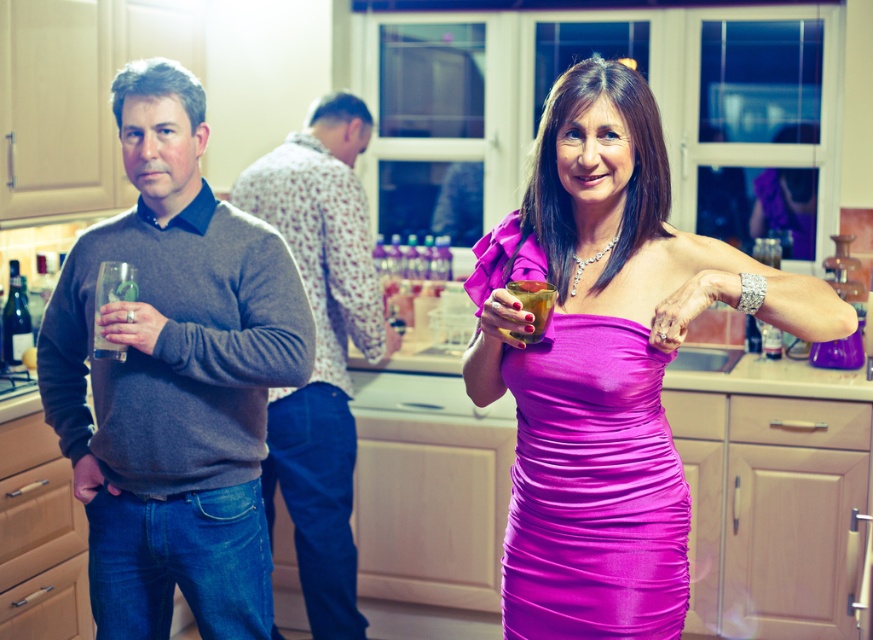
You are a photographer setting up a camera to capture the scene. The gray sweater at left and the translucent glass drink at center are both in focus. Which object would appear larger in the photo?

The gray sweater at left would appear larger in the photo because it is bigger than the translucent glass drink at center.